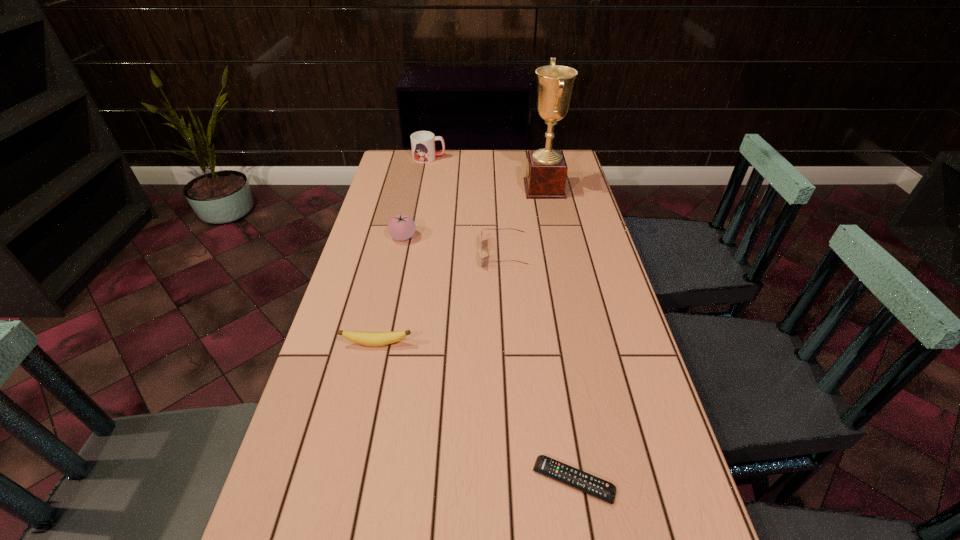
At what (x,y) coordinates should I click in order to perform the action: click on mug that is at the far edge. Please return your answer as a coordinate pair (x, y). This screenshot has width=960, height=540. Looking at the image, I should click on (422, 142).

This screenshot has height=540, width=960. I want to click on mug present at the left edge, so click(x=422, y=142).

Image resolution: width=960 pixels, height=540 pixels. Identify the location of tomato that is positioned at the left edge. (400, 227).

At what (x,y) coordinates should I click in order to perform the action: click on banana at the left edge. Please return your answer as a coordinate pair (x, y). Image resolution: width=960 pixels, height=540 pixels. Looking at the image, I should click on (365, 338).

The width and height of the screenshot is (960, 540). I want to click on trophy cup situated at the right edge, so click(x=546, y=173).

Find the location of `remote control situated at the right edge`. remote control situated at the right edge is located at coordinates (568, 475).

Identify the location of object present at the far left corner. This screenshot has width=960, height=540. pyautogui.click(x=422, y=142).

At what (x,y) coordinates should I click in order to perform the action: click on object situated at the far right corner. Please return your answer as a coordinate pair (x, y). Looking at the image, I should click on (546, 173).

Locate an element on the screen. Image resolution: width=960 pixels, height=540 pixels. blank space at the far edge of the desktop is located at coordinates (519, 177).

Where is `free region at the left edge of the desktop`? The image size is (960, 540). free region at the left edge of the desktop is located at coordinates (398, 193).